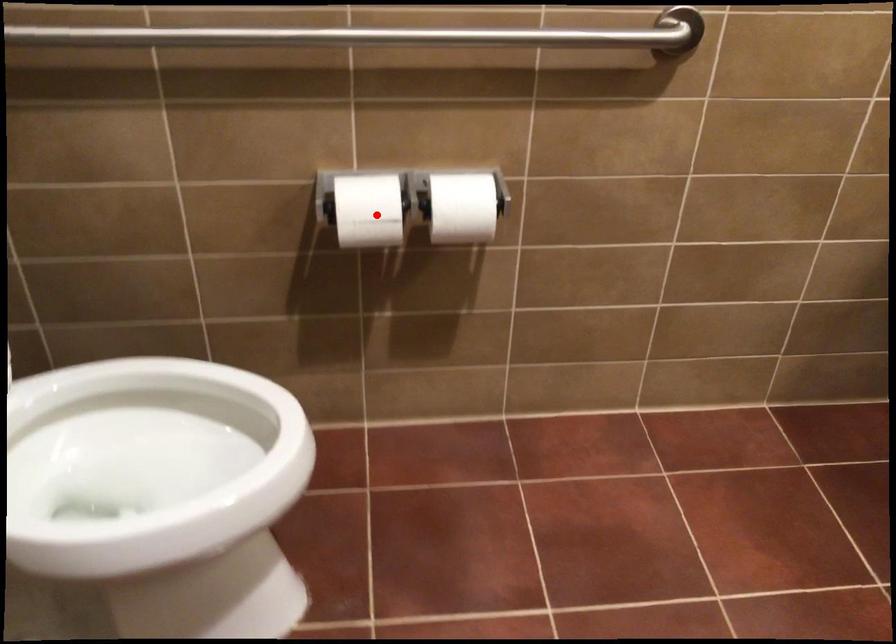
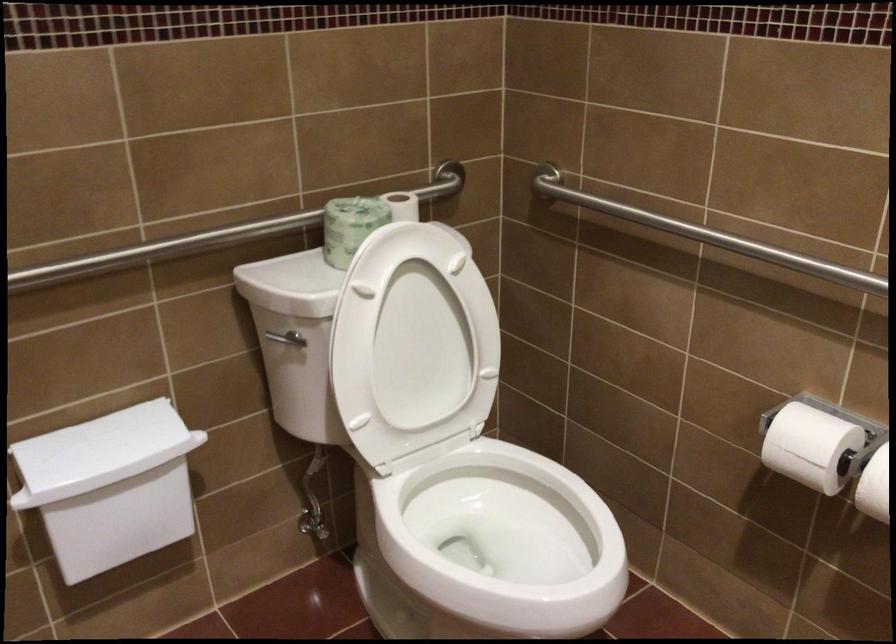
In the second image, find the point that corresponds to the highlighted location in the first image.

(810, 446)